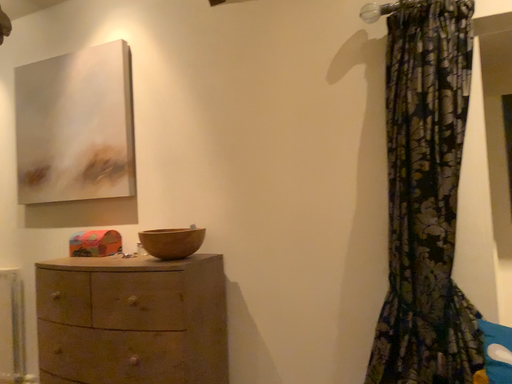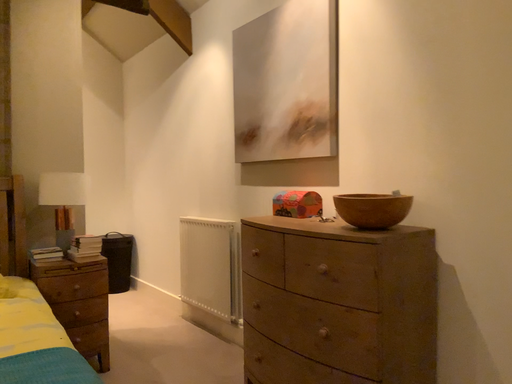
Question: How did the camera likely rotate when shooting the video?

Choices:
 (A) rotated left
 (B) rotated right

Answer: (A)